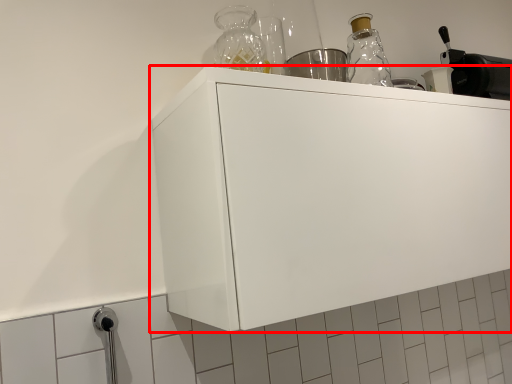
Question: Where is cabinetry (annotated by the red box) located in relation to appliance in the image?

Choices:
 (A) right
 (B) left

Answer: (B)